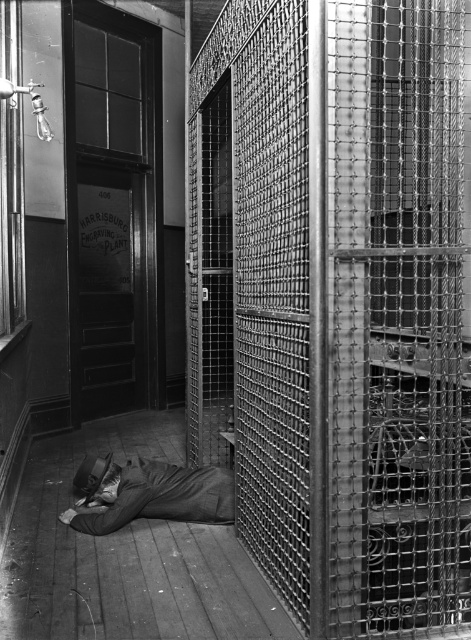
You are a delivery person who needs to place a heavy box on a surface in the jail cell. You see the metal mesh cage at center and the dark gray fabric at lower center. Which surface can safely support the weight?

The dark gray fabric at lower center cannot support heavy weight as it is a fabric, while the metal mesh cage at center is made of metal and can safely hold the box.

From the picture: You are a prisoner trying to escape through the cell door. You see a metal mesh cage at center and a dark gray fabric at lower center. Which object should you move first to reach the door?

You should move the dark gray fabric at lower center first because the metal mesh cage at center is to the right of it, so moving the fabric first would clear the path towards the door.